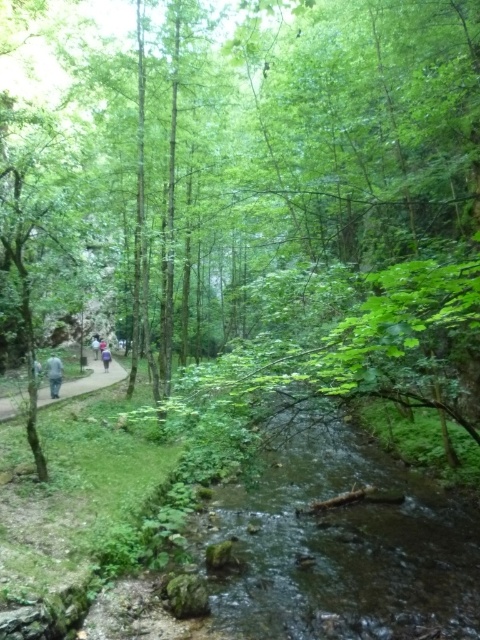
Question: Which of the following is the closest to the observer?

Choices:
 (A) (55, 378)
 (B) (95, 349)
 (C) (104, 369)

Answer: (A)

Question: From the image, what is the correct spatial relationship of light blue jeans at left in relation to light blue fabric at left?

Choices:
 (A) left
 (B) right

Answer: (B)

Question: Which object is farther from the camera taking this photo?

Choices:
 (A) green leafy path at left
 (B) green fabric person at center
 (C) light blue shirt at center

Answer: (C)

Question: Does green fabric person at center appear on the left side of light blue fabric at left?

Choices:
 (A) no
 (B) yes

Answer: (A)

Question: Which object is positioned closest to the green leafy path at left?

Choices:
 (A) light blue shirt at center
 (B) clear water stream at center
 (C) green fabric person at center

Answer: (C)

Question: Can you confirm if green leafy path at left is thinner than green fabric person at center?

Choices:
 (A) yes
 (B) no

Answer: (B)